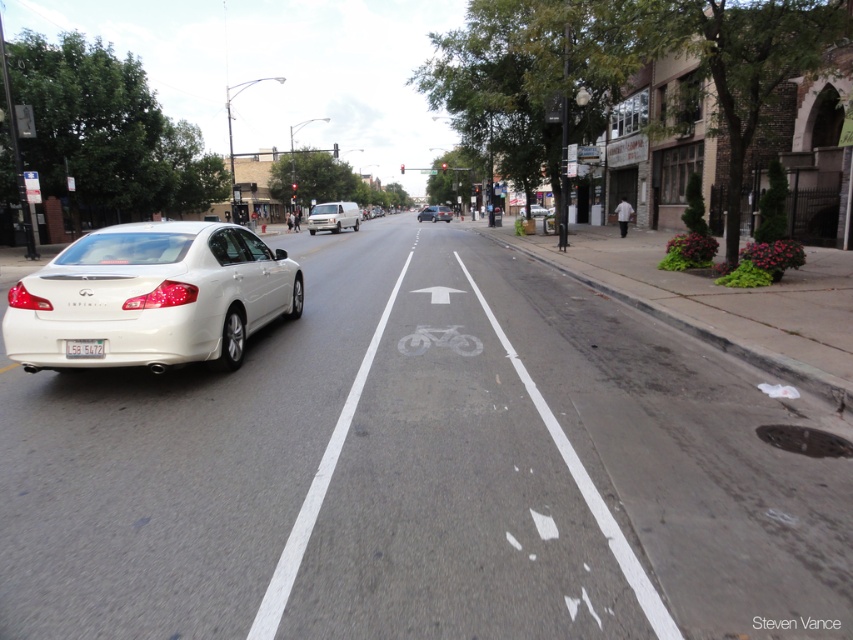
You are a pedestrian standing at the crosswalk. You see a white glossy sedan at left and a white matte sedan at center. Which one is closer to your left side?

The white glossy sedan at left is closer to your left side because it is positioned to the left of the white matte sedan at center.

You are a pedestrian standing at the crosswalk and want to reach the bus stop located at point (532,212). There is a white sedan at point (424,216) blocking your path. Can you safely walk around the car to reach the bus stop?

Point (424,216) is further to the viewer than point (532,212), so the white sedan at point (424,216) is closer to you. You can safely walk around it to reach the bus stop at point (532,212).

You are a pedestrian standing at the crosswalk. You see a white glossy sedan at left and a white matte sedan at center. Which car is closer to you?

The white glossy sedan at left is closer to you because it is positioned under the white matte sedan at center, indicating it is in front.